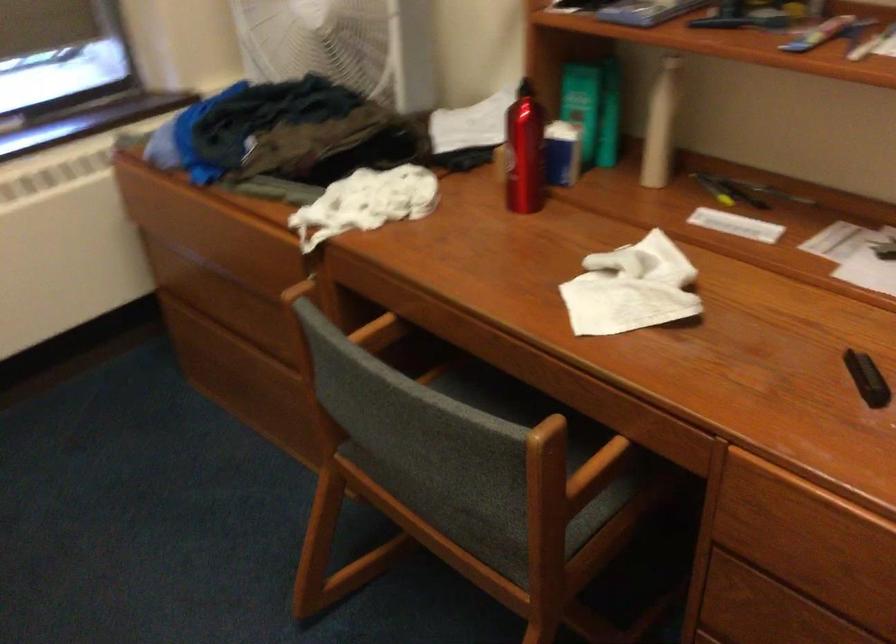
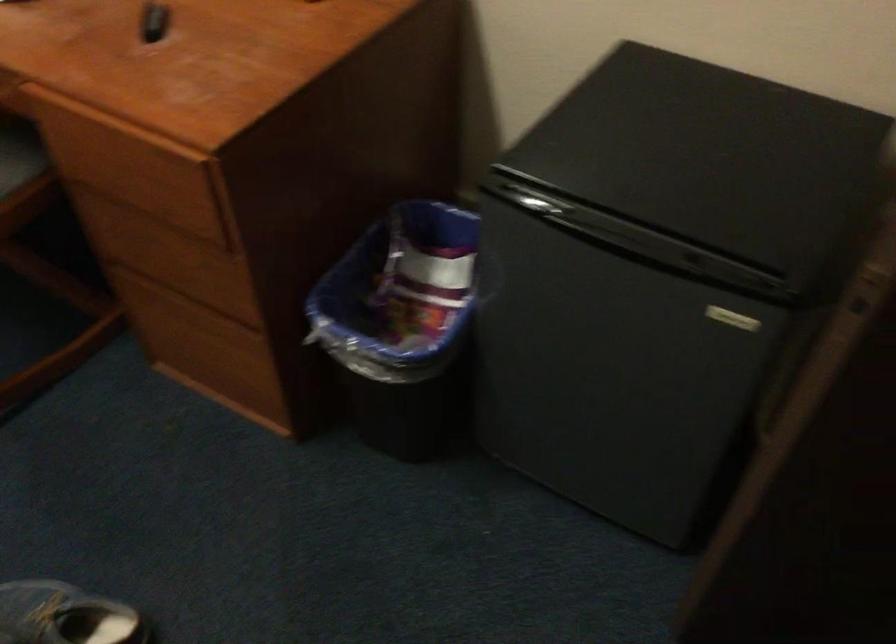
What movement of the cameraman would produce the second image?

The movement direction of the cameraman is right, backward.